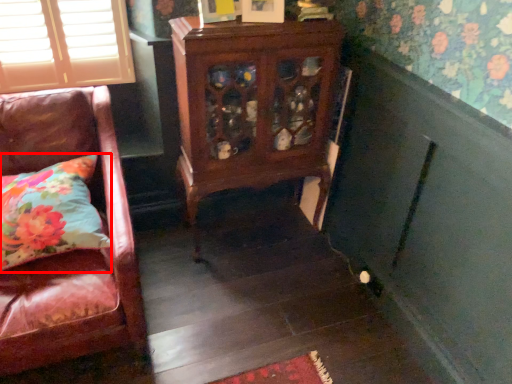
Question: From the image, what is the correct spatial relationship of pillow (annotated by the red box) in relation to furniture?

Choices:
 (A) left
 (B) right

Answer: (A)